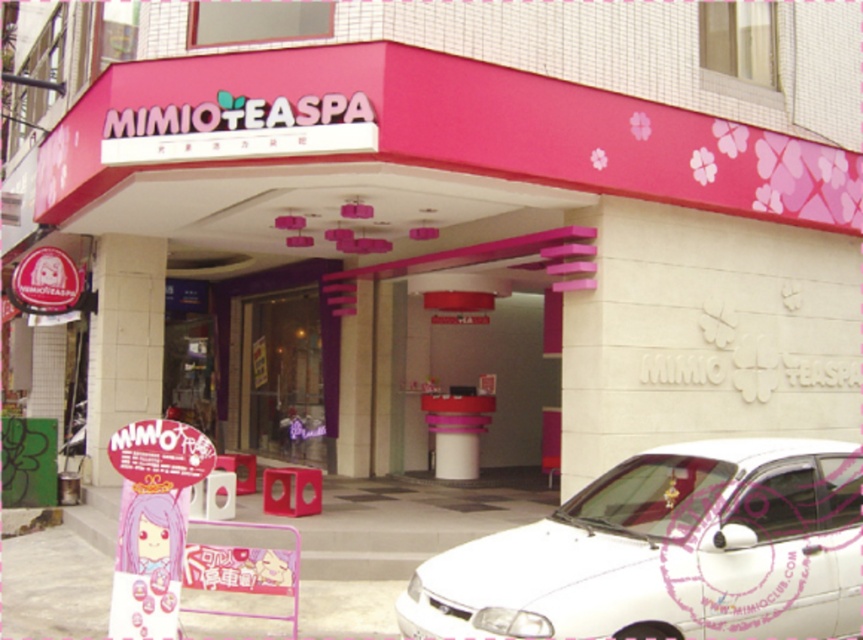
From the picture: Does white glossy car at lower right appear on the left side of transparent glass door at center?

In fact, white glossy car at lower right is to the right of transparent glass door at center.

Is the position of white glossy car at lower right less distant than that of transparent glass door at center?

Yes, white glossy car at lower right is in front of transparent glass door at center.

Between point (613, 467) and point (241, 445), which one is positioned behind?

The point (241, 445) is behind.

You are a GUI agent. You are given a task and a screenshot of the screen. Output one action in this format:
    pyautogui.click(x=<x>, y=<y>)
    Task: Click on the white glossy car at lower right
    This screenshot has width=863, height=640.
    Given the screenshot: What is the action you would take?
    pyautogui.click(x=666, y=552)

In the scene shown: Is white glossy car at lower right positioned in front of white textured pillar at left?

Yes, it is in front of white textured pillar at left.

Can you confirm if white glossy car at lower right is wider than white textured pillar at left?

Indeed, white glossy car at lower right has a greater width compared to white textured pillar at left.

What do you see at coordinates (666, 552) in the screenshot?
I see `white glossy car at lower right` at bounding box center [666, 552].

The image size is (863, 640). I want to click on white glossy car at lower right, so click(x=666, y=552).

Between white textured pillar at left and transparent glass door at center, which one has more height?

white textured pillar at left is taller.

From the picture: Is white textured pillar at left positioned at the back of transparent glass door at center?

No, it is not.

I want to click on white textured pillar at left, so click(123, 340).